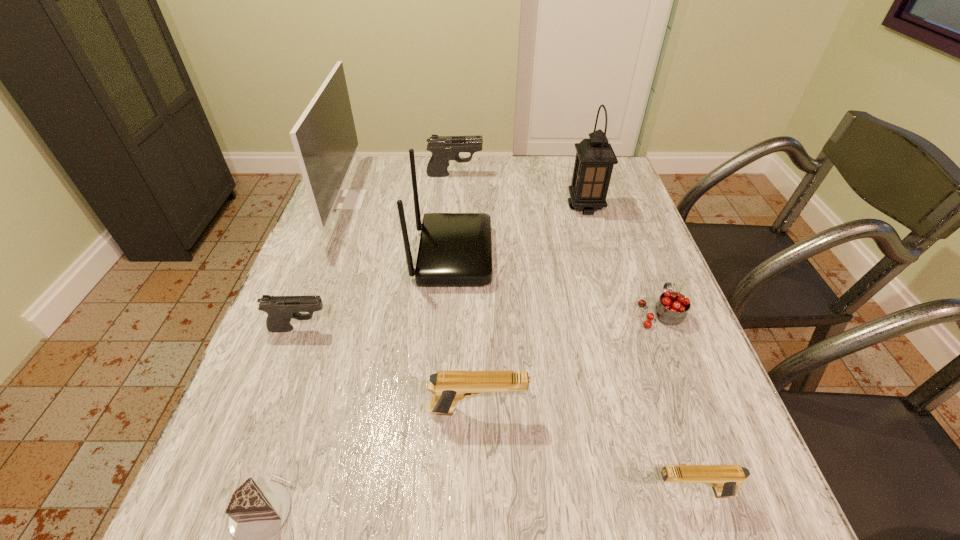
Identify the location of the smaller tan pistol. The image size is (960, 540). (725, 479).

The width and height of the screenshot is (960, 540). I want to click on the right tan pistol, so click(725, 479).

Identify the location of vacant region located on the front-facing side of the black monitor. (424, 200).

Locate an element on the screen. The image size is (960, 540). vacant area situated 0.100m on the left of the black lantern is located at coordinates tap(534, 207).

This screenshot has width=960, height=540. What are the coordinates of `free space located 0.200m on the front-facing side of the router` in the screenshot? It's located at (569, 255).

Where is `vacant region located at the barrel of the farthest pistol`? vacant region located at the barrel of the farthest pistol is located at coordinates (591, 174).

What are the coordinates of `vacant region located 0.230m at the barrel of the third farthest pistol` in the screenshot? It's located at (649, 410).

The width and height of the screenshot is (960, 540). What are the coordinates of `vacant space located at the barrel of the second farthest pistol` in the screenshot? It's located at (509, 328).

Image resolution: width=960 pixels, height=540 pixels. I want to click on vacant region located on the handle side of the red cherry, so click(631, 238).

Locate an element on the screen. free space located on the handle side of the red cherry is located at coordinates (634, 245).